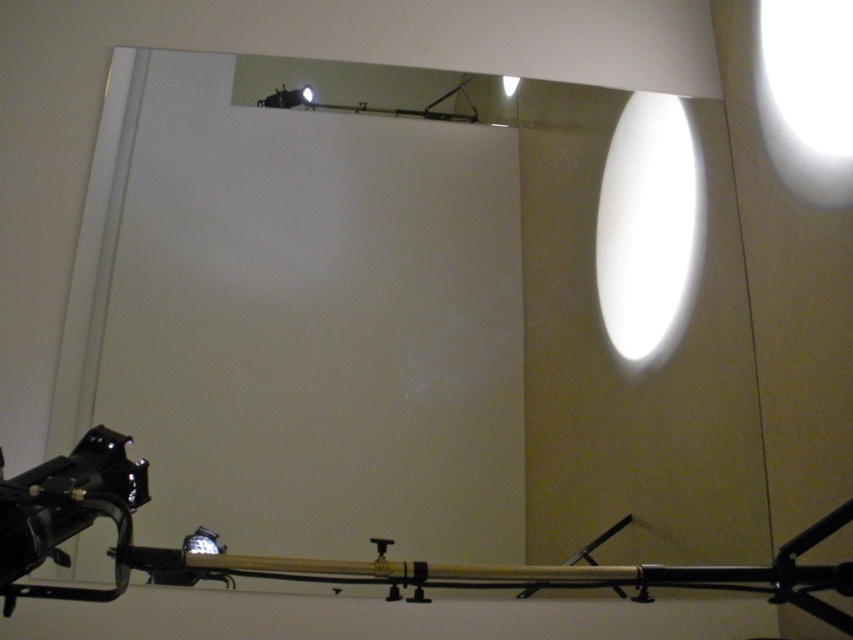
You are adjusting a camera rig in a studio. You have two points marked on your equipment at coordinates point [44,547] and point [515,88]. Which point is closer to the camera lens if the camera is positioned to capture the reflection in the mirror?

Point [44,547] is in front of point [515,88], so it is closer to the camera lens.